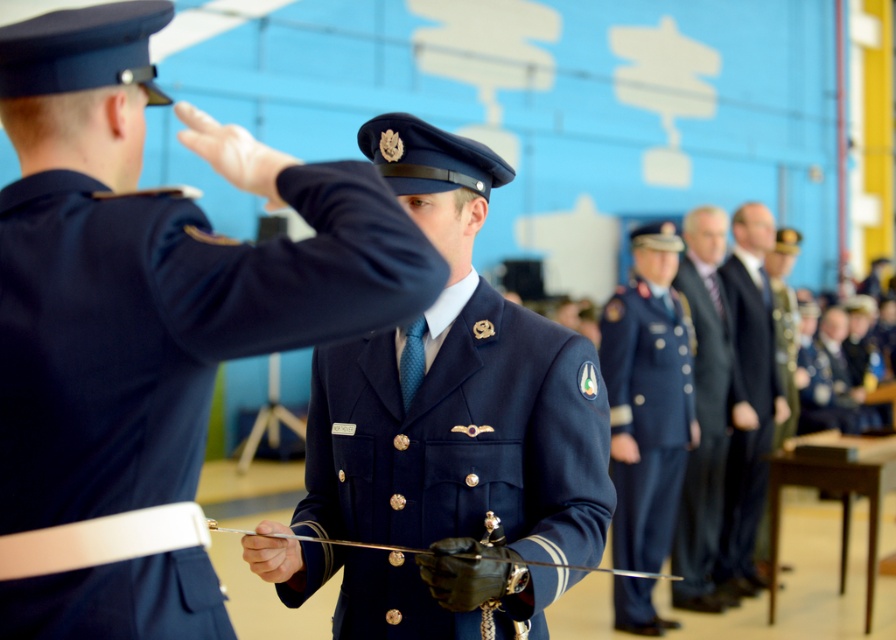
Question: Among these points, which one is nearest to the camera?

Choices:
 (A) (683, 522)
 (B) (18, 115)
 (C) (677, 486)

Answer: (B)

Question: Estimate the real-world distances between objects in this image. Which object is farther from the navy blue uniform at center?

Choices:
 (A) blue fabric uniform at center
 (B) navy blue woolen jacket at center

Answer: (A)

Question: Is blue fabric uniform at center positioned before dark gray suit at center?

Choices:
 (A) yes
 (B) no

Answer: (A)

Question: In this image, where is navy blue uniform at center located relative to dark blue suit at center?

Choices:
 (A) right
 (B) left

Answer: (B)

Question: Does blue fabric uniform at center have a smaller size compared to dark gray suit at center?

Choices:
 (A) yes
 (B) no

Answer: (B)

Question: Which object appears closest to the camera in this image?

Choices:
 (A) navy blue uniform at center
 (B) dark gray suit at center
 (C) dark blue suit at center

Answer: (A)